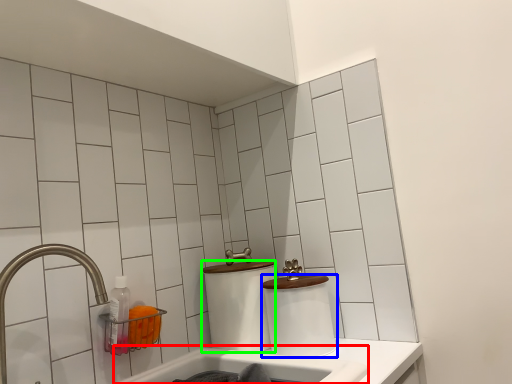
Question: Which is nearer to the bath (highlighted by a red box)? toilet paper (highlighted by a blue box) or toilet paper (highlighted by a green box).

Choices:
 (A) toilet paper
 (B) toilet paper

Answer: (A)